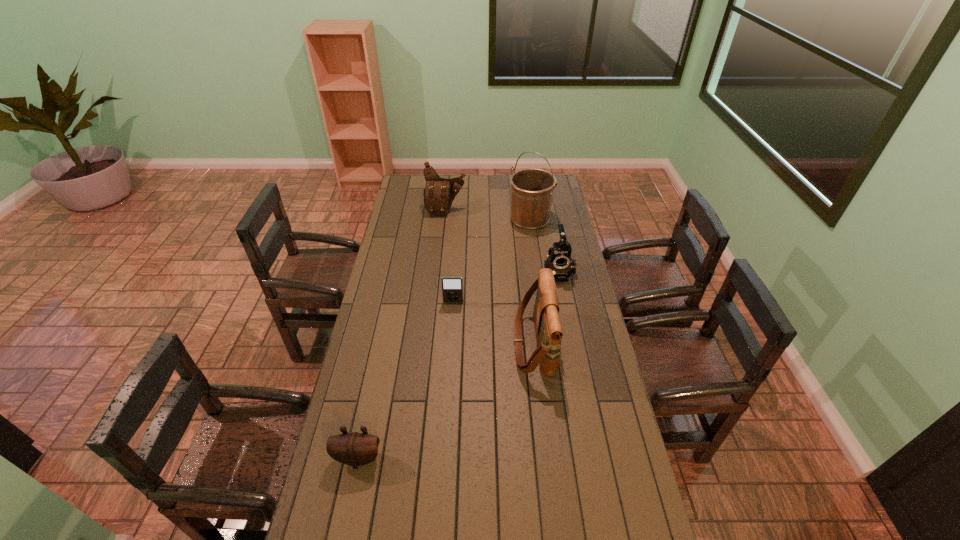
The width and height of the screenshot is (960, 540). I want to click on camcorder situated at the right edge, so click(559, 260).

The height and width of the screenshot is (540, 960). In the image, there is a desktop. What are the coordinates of `vacant region at the far edge` in the screenshot? It's located at (466, 179).

What are the coordinates of `vacant space at the left edge of the desktop` in the screenshot? It's located at (380, 332).

Locate an element on the screen. The image size is (960, 540). free space at the right edge is located at coordinates (540, 230).

Find the location of a particular element. empty space between the fifth farthest object and the pouch is located at coordinates (445, 401).

Find the location of a particular element. free space between the fourth farthest object and the camcorder is located at coordinates click(x=505, y=287).

What are the coordinates of `free space between the left shoulder bag and the fourth farthest object` in the screenshot? It's located at (449, 256).

This screenshot has height=540, width=960. What are the coordinates of `unoccupied position between the left shoulder bag and the bucket` in the screenshot? It's located at (488, 214).

Where is `unoccupied position between the left shoulder bag and the fifth farthest object`? The height and width of the screenshot is (540, 960). unoccupied position between the left shoulder bag and the fifth farthest object is located at coordinates (490, 277).

What are the coordinates of `vacant space that is in between the third nearest object and the farther shoulder bag` in the screenshot? It's located at (449, 256).